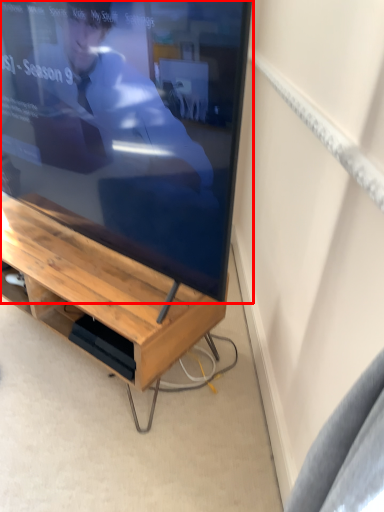
Question: From the image's perspective, where is television (annotated by the red box) located in relation to desk in the image?

Choices:
 (A) above
 (B) below

Answer: (A)